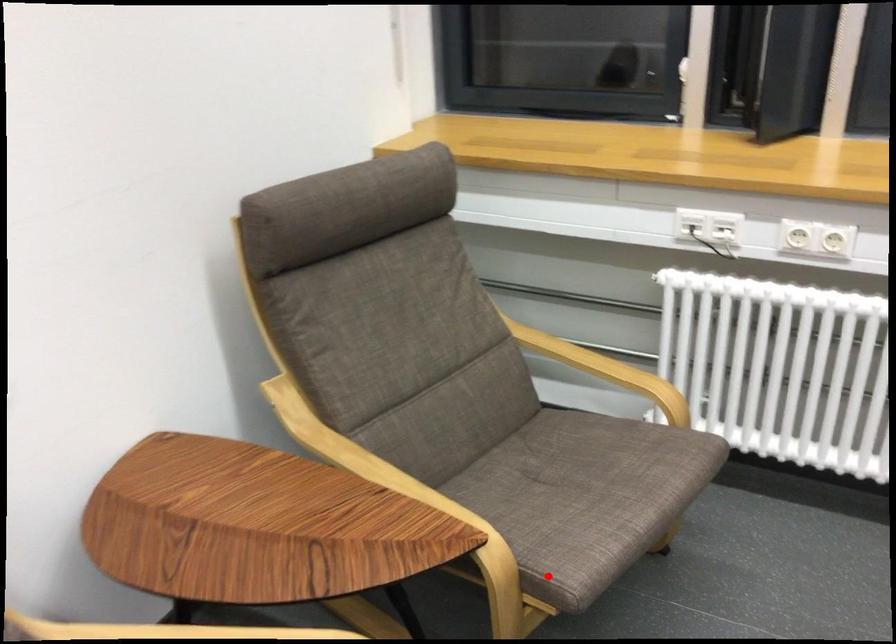
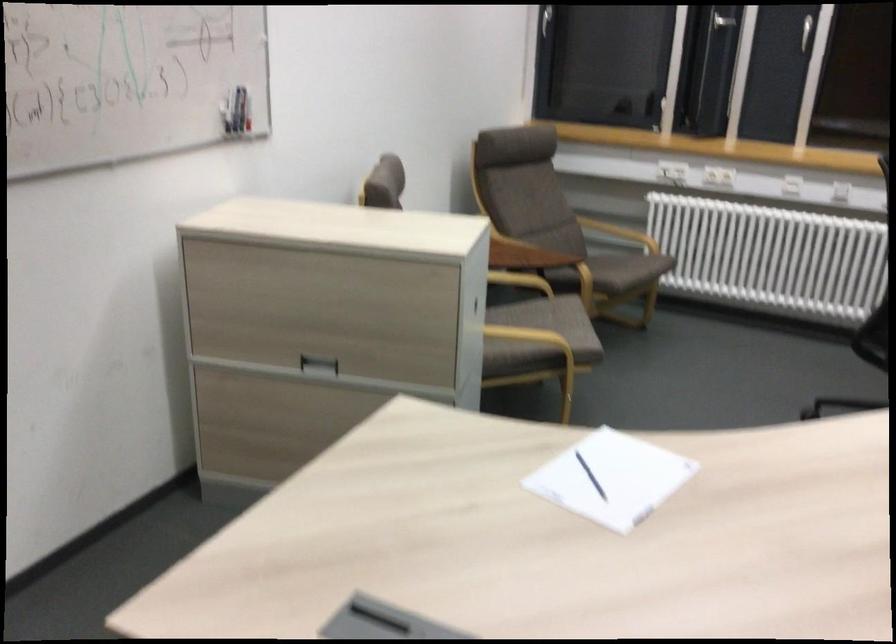
Where in the second image is the point corresponding to the highlighted location from the first image?

(618, 270)